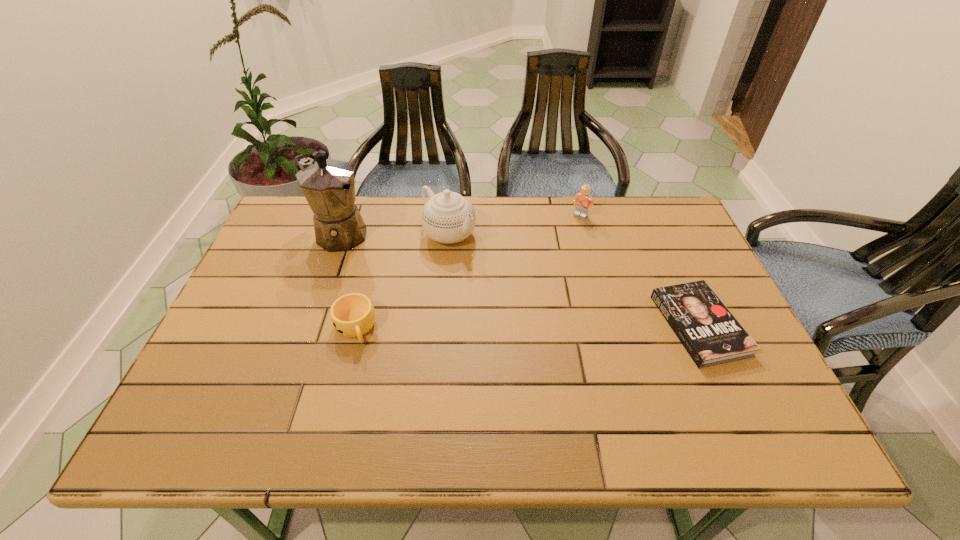
I want to click on free space between the third object from left to right and the tallest object, so click(394, 234).

Locate an element on the screen. This screenshot has height=540, width=960. free space between the coffeepot and the cup is located at coordinates (347, 281).

Locate an element on the screen. This screenshot has width=960, height=540. empty space between the fourth object from left to right and the book is located at coordinates (640, 271).

This screenshot has height=540, width=960. In order to click on vacant area between the second tallest object and the coffeepot in this screenshot , I will do `click(394, 234)`.

Identify the location of unoccupied area between the coffeepot and the third object from right to left. Image resolution: width=960 pixels, height=540 pixels. (394, 234).

Find the location of a particular element. This screenshot has height=540, width=960. vacant space that is in between the book and the chinaware is located at coordinates (574, 280).

Identify the location of vacant point located between the tallest object and the shortest object. (518, 280).

Identify the location of empty space that is in between the tallest object and the fourth tallest object. The width and height of the screenshot is (960, 540). (347, 281).

Locate an element on the screen. The height and width of the screenshot is (540, 960). vacant area that lies between the fourth tallest object and the third object from right to left is located at coordinates (402, 281).

At what (x,y) coordinates should I click in order to perform the action: click on object that is the closest to the tallest object. Please return your answer as a coordinate pair (x, y). The width and height of the screenshot is (960, 540). Looking at the image, I should click on (447, 217).